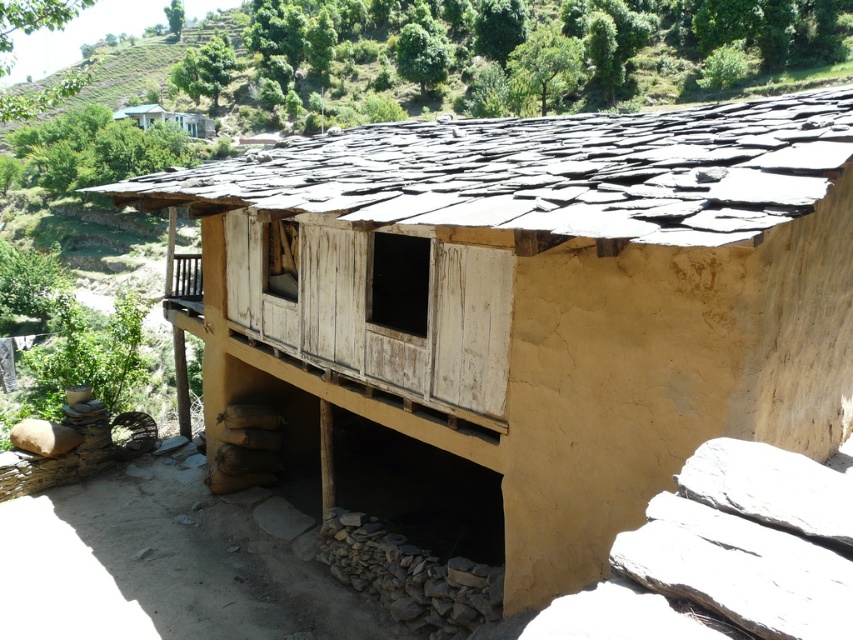
Question: Which point is closer to the camera?

Choices:
 (A) light blue wooden house at upper left
 (B) dark gray slate roof at upper center

Answer: (B)

Question: Can you confirm if dark gray slate roof at upper center is bigger than light blue wooden house at upper left?

Choices:
 (A) yes
 (B) no

Answer: (A)

Question: Where is dark gray slate roof at upper center located in relation to light blue wooden house at upper left in the image?

Choices:
 (A) below
 (B) above

Answer: (A)

Question: Considering the relative positions of dark gray slate roof at upper center and light blue wooden house at upper left in the image provided, where is dark gray slate roof at upper center located with respect to light blue wooden house at upper left?

Choices:
 (A) below
 (B) above

Answer: (A)